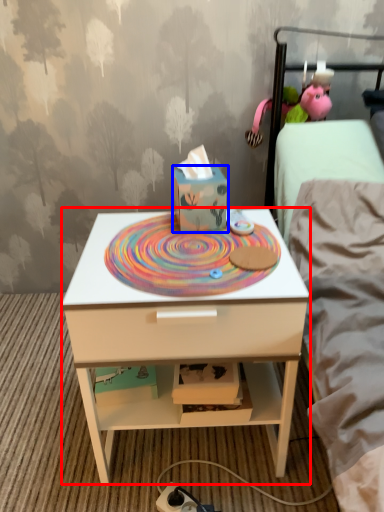
Question: Which point is further to the camera, nightstand (highlighted by a red box) or cardboard box (highlighted by a blue box)?

Choices:
 (A) nightstand
 (B) cardboard box

Answer: (B)